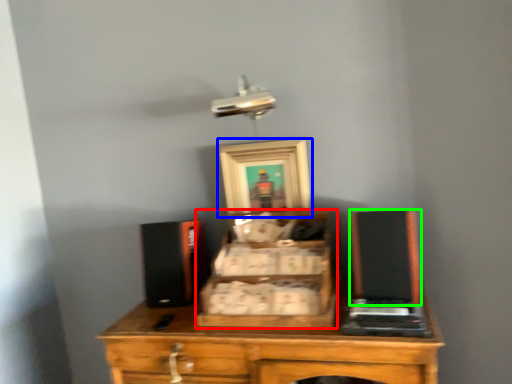
Question: Which is nearer to the drawer (highlighted by a red box)? picture frame (highlighted by a blue box) or wide (highlighted by a green box).

Choices:
 (A) picture frame
 (B) wide

Answer: (B)